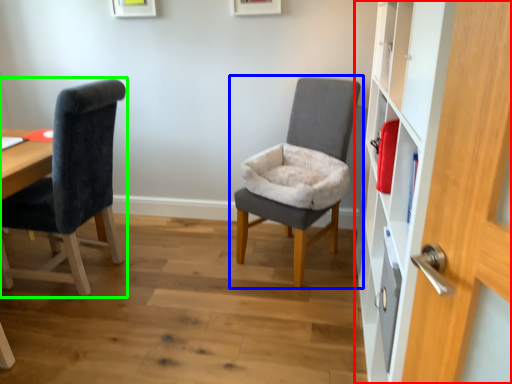
Question: Based on their relative distances, which object is nearer to dresser (highlighted by a red box)? Choose from chair (highlighted by a blue box) and chair (highlighted by a green box).

Choices:
 (A) chair
 (B) chair

Answer: (A)